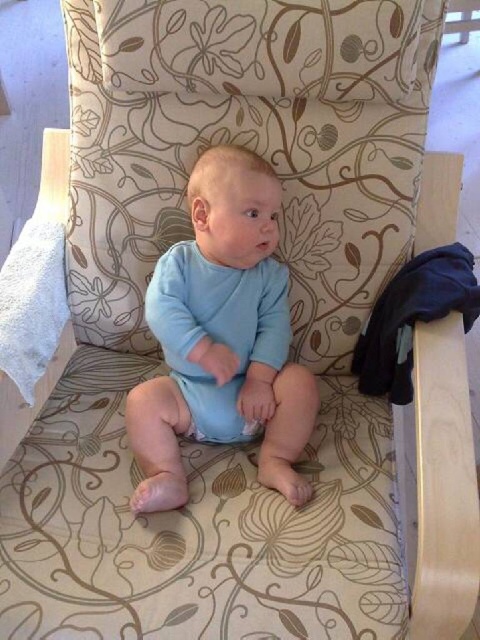
The baby is wearing a smooth blue onesie at center and a blue soft diaper at center. Which one is positioned more to the right?

The smooth blue onesie at center is positioned to the right of the blue soft diaper at center.

You are a babysitter who needs to ensure the baby is dressed appropriately. The baby is wearing a smooth blue onesie at center and a blue soft diaper at center. Which item of clothing is longer in height?

The smooth blue onesie at center is taller than the blue soft diaper at center, so the smooth blue onesie at center is longer in height.